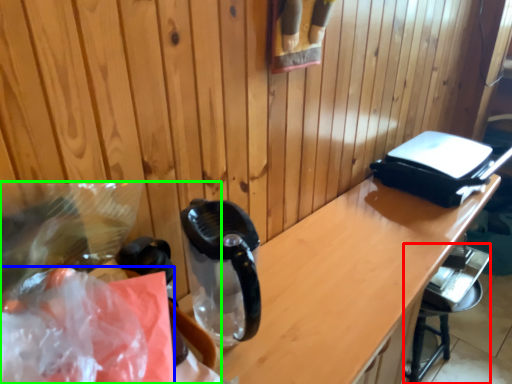
Question: Which object is positioned closest to bar stool (highlighted by a red box)? Select from plastic bag (highlighted by a blue box) and waste (highlighted by a green box).

Choices:
 (A) plastic bag
 (B) waste

Answer: (B)